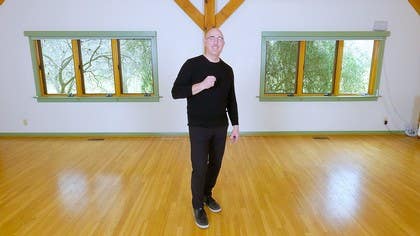
I want to click on wood blocks, so click(x=40, y=67), click(x=77, y=62), click(x=115, y=63), click(x=300, y=61), click(x=336, y=62), click(x=372, y=63).